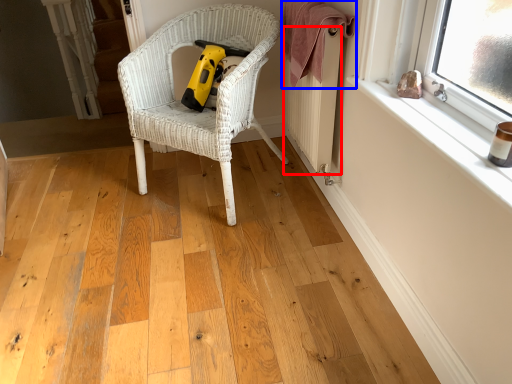
Question: Which of the following is the farthest to the observer, radiator (highlighted by a red box) or blanket (highlighted by a blue box)?

Choices:
 (A) radiator
 (B) blanket

Answer: (A)